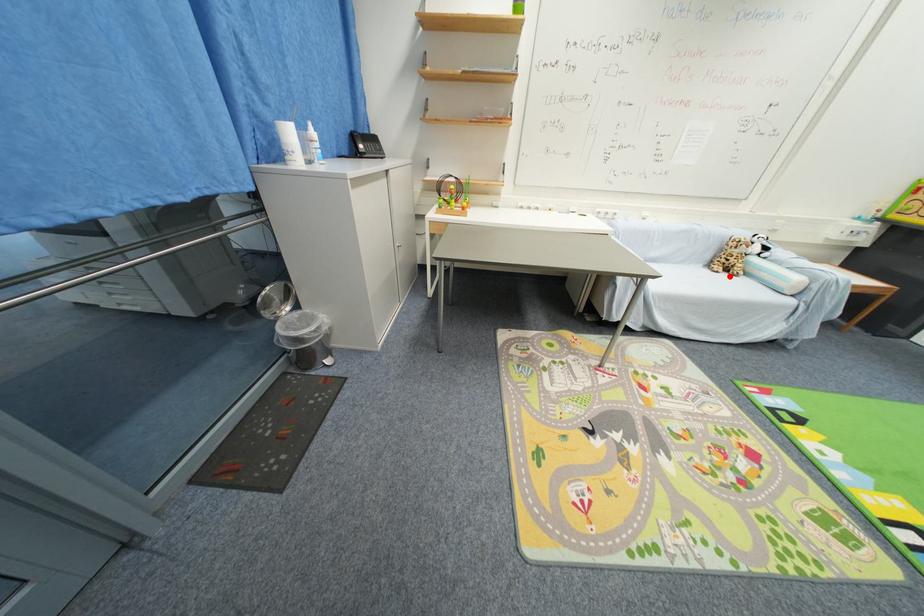
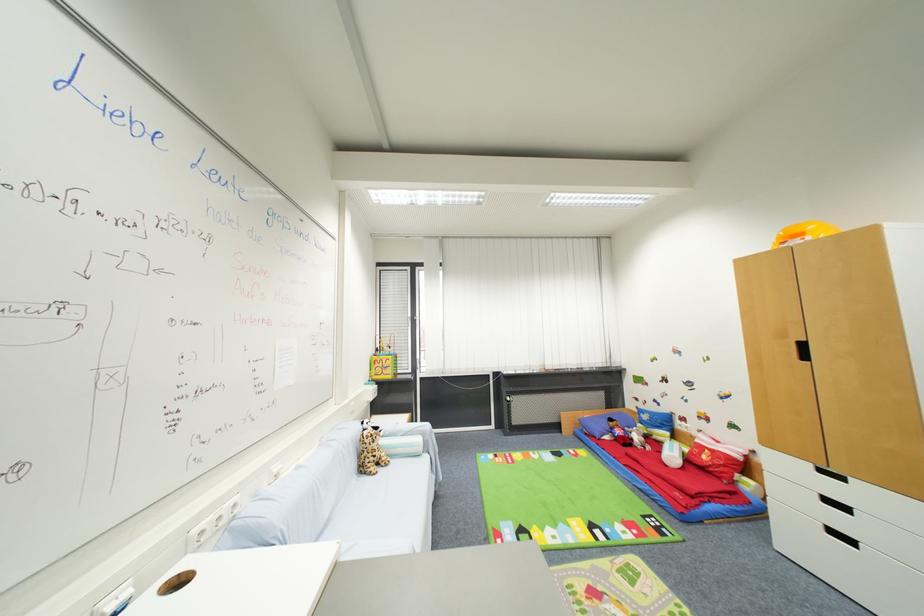
Find the pixel in the second image that matches the highlighted location in the first image.

(385, 472)